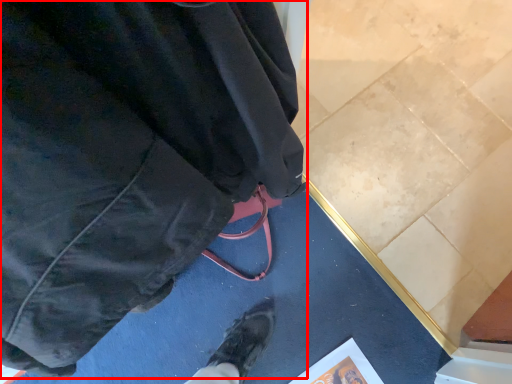
Question: From the image's perspective, where is jacket (annotated by the red box) located in relation to paperback book in the image?

Choices:
 (A) above
 (B) below

Answer: (A)